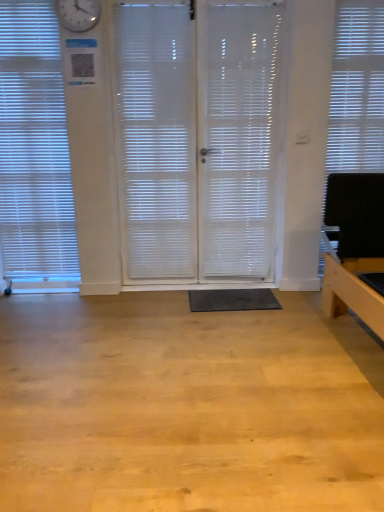
Question: Is white matte window blind at right, which is counted as the second window blind, starting from the left, facing away from white translucent blinds at left, the 2th window blind viewed from the right?

Choices:
 (A) no
 (B) yes

Answer: (A)

Question: From the image's perspective, would you say white matte window blind at right, which is the first window blind in right-to-left order, is shown under white translucent blinds at left, the first window blind in the left-to-right sequence?

Choices:
 (A) no
 (B) yes

Answer: (A)

Question: From a real-world perspective, is white matte window blind at right, which is the first window blind in right-to-left order, over white translucent blinds at left, the first window blind in the left-to-right sequence?

Choices:
 (A) yes
 (B) no

Answer: (B)

Question: Is white matte window blind at right, which is the first window blind in right-to-left order, located outside white translucent blinds at left, the first window blind in the left-to-right sequence?

Choices:
 (A) no
 (B) yes

Answer: (B)

Question: From a real-world perspective, is white matte window blind at right, which is counted as the second window blind, starting from the left, below white translucent blinds at left, the first window blind in the left-to-right sequence?

Choices:
 (A) no
 (B) yes

Answer: (B)

Question: Is white matte window blind at right, which is counted as the second window blind, starting from the left, smaller than white translucent blinds at left, the first window blind in the left-to-right sequence?

Choices:
 (A) no
 (B) yes

Answer: (B)

Question: Does white matte window blind at right, which is counted as the second window blind, starting from the left, have a larger size compared to white frosted glass shutter at center?

Choices:
 (A) yes
 (B) no

Answer: (B)

Question: Does white matte window blind at right, which is the first window blind in right-to-left order, have a lesser width compared to white frosted glass shutter at center?

Choices:
 (A) no
 (B) yes

Answer: (B)

Question: Does white matte window blind at right, which is counted as the second window blind, starting from the left, have a lesser height compared to white frosted glass shutter at center?

Choices:
 (A) no
 (B) yes

Answer: (A)

Question: From a real-world perspective, is white matte window blind at right, which is the first window blind in right-to-left order, physically below white frosted glass shutter at center?

Choices:
 (A) yes
 (B) no

Answer: (B)

Question: Can you confirm if white matte window blind at right, which is the first window blind in right-to-left order, is positioned to the left of white frosted glass shutter at center?

Choices:
 (A) no
 (B) yes

Answer: (A)

Question: Is white matte window blind at right, which is counted as the second window blind, starting from the left, touching white frosted glass shutter at center?

Choices:
 (A) yes
 (B) no

Answer: (B)

Question: From the image's perspective, does white frosted glass shutter at center appear higher than white translucent screen door at center, the 1th screen door viewed from the right?

Choices:
 (A) no
 (B) yes

Answer: (B)